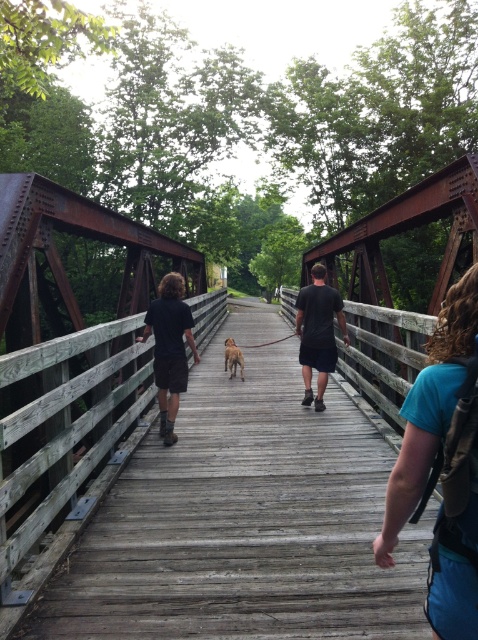
Question: Observing the image, what is the correct spatial positioning of dark blue shirt at center in reference to black matte shorts at center?

Choices:
 (A) above
 (B) below

Answer: (B)

Question: Does wooden bridge at center lie behind brown furry dog at center?

Choices:
 (A) no
 (B) yes

Answer: (A)

Question: Which of these objects is positioned closest to the rusty metal bridge at left?

Choices:
 (A) wooden bridge at center
 (B) brown leather leash at center
 (C) dark blue shirt at center
 (D) blue fabric backpack at center right

Answer: (C)

Question: Does rusty metal bridge at center come behind brown leather leash at center?

Choices:
 (A) yes
 (B) no

Answer: (B)

Question: Which object is closer to the camera taking this photo?

Choices:
 (A) black matte shorts at center
 (B) dark blue shirt at center
 (C) wooden bridge at center

Answer: (C)

Question: Which object appears farthest from the camera in this image?

Choices:
 (A) wooden bridge at center
 (B) blue fabric backpack at center right

Answer: (A)